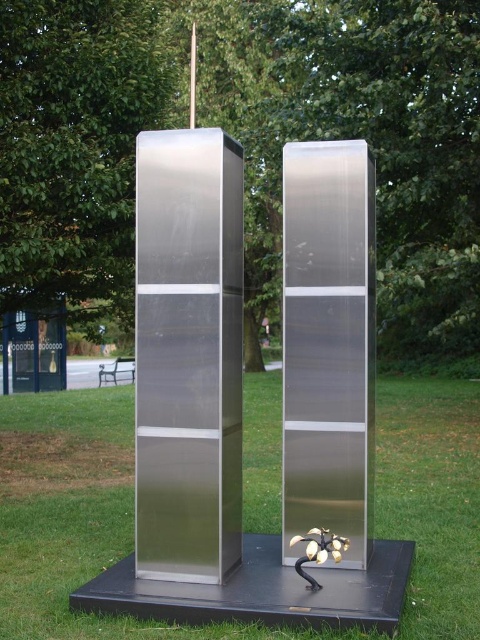
In the scene shown: You are a gardener who wants to plant a new flower in the image. The flower needs a spot that is wider than the satin metallic column at center. Can the green grass at center provide enough space for the flower?

The green grass at center might be wider than the satin metallic column at center, so it could potentially provide enough space for the flower.

You are a gardener who wants to plant a new flower in the garden. You see the green grass at center and the satin silver sculpture at center. Which area is more suitable for planting the flower?

The green grass at center is more suitable for planting the flower since it is wider than the satin silver sculpture at center, providing enough space for the flower to grow.

You are an art curator planning to move the satin metallic column at center and the satin silver sculpture at center to a new gallery layout. If you want to maintain the same spatial relationship between them as in the original image, which sculpture should you place closer to the entrance of the new gallery?

The satin metallic column at center should be placed closer to the entrance because it is closer to the viewer than the satin silver sculpture at center in the original image.